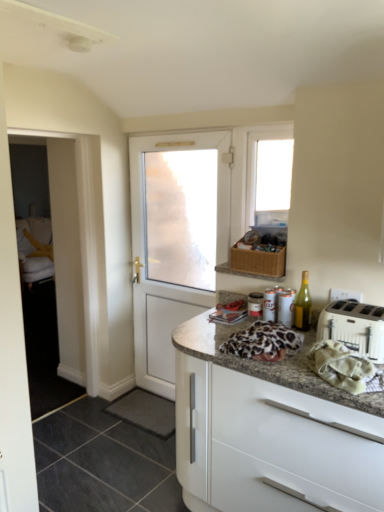
Question: Should I look upward or downward to see white glossy cabinet at lower right?

Choices:
 (A) up
 (B) down

Answer: (B)

Question: Is metallic silver canister at upper right surrounded by black rubber mat at lower center, which is the 1th tile from back to front?

Choices:
 (A) yes
 (B) no

Answer: (B)

Question: Is black rubber mat at lower center, the second tile in the front-to-back sequence, in contact with metallic silver canister at upper right?

Choices:
 (A) yes
 (B) no

Answer: (B)

Question: From the image's perspective, would you say black rubber mat at lower center, which is the 1th tile from back to front, is positioned over metallic silver canister at upper right?

Choices:
 (A) yes
 (B) no

Answer: (B)

Question: Does black rubber mat at lower center, the second tile in the front-to-back sequence, appear on the right side of metallic silver canister at upper right?

Choices:
 (A) no
 (B) yes

Answer: (A)

Question: Does black rubber mat at lower center, which is the 1th tile from back to front, appear on the left side of metallic silver canister at upper right?

Choices:
 (A) no
 (B) yes

Answer: (B)

Question: Is black rubber mat at lower center, which is the 1th tile from back to front, turned away from metallic silver canister at upper right?

Choices:
 (A) no
 (B) yes

Answer: (A)

Question: Can you confirm if white plastic toaster at right is shorter than white cloth at right?

Choices:
 (A) no
 (B) yes

Answer: (A)

Question: Is white plastic toaster at right wider than white cloth at right?

Choices:
 (A) no
 (B) yes

Answer: (B)

Question: Does white plastic toaster at right have a smaller size compared to white cloth at right?

Choices:
 (A) yes
 (B) no

Answer: (B)

Question: Is white plastic toaster at right aimed at white cloth at right?

Choices:
 (A) yes
 (B) no

Answer: (A)

Question: Does white plastic toaster at right lie behind white cloth at right?

Choices:
 (A) yes
 (B) no

Answer: (A)

Question: Is white plastic toaster at right positioned with its back to white cloth at right?

Choices:
 (A) yes
 (B) no

Answer: (B)

Question: From a real-world perspective, is green glass bottle at right on white cloth at right?

Choices:
 (A) yes
 (B) no

Answer: (A)